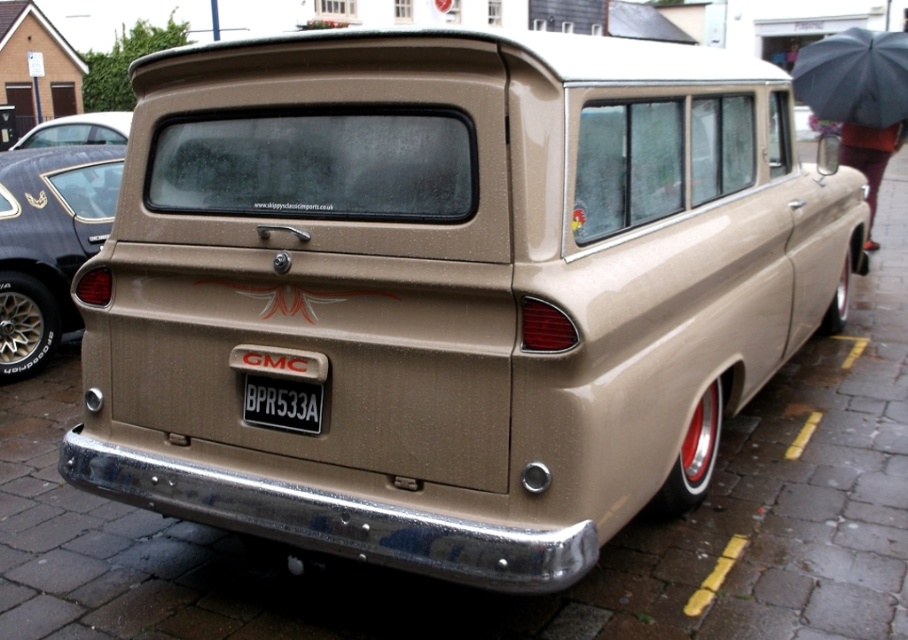
Does matte gold van at center appear over matte black car at upper left?

Incorrect, matte gold van at center is not positioned above matte black car at upper left.

Can you confirm if matte gold van at center is positioned to the right of matte black car at upper left?

Yes, matte gold van at center is to the right of matte black car at upper left.

Is point (25, 264) in front of point (48, 131)?

Yes, it is in front of point (48, 131).

What are the coordinates of `matte gold van at center` in the screenshot? It's located at (48, 243).

Who is positioned more to the right, matte gold van at center or black plastic license plate at center?

black plastic license plate at center is more to the right.

Does matte gold van at center have a greater height compared to black plastic license plate at center?

Indeed, matte gold van at center has a greater height compared to black plastic license plate at center.

Between point (25, 198) and point (307, 428), which one is positioned in front?

Point (307, 428)

Image resolution: width=908 pixels, height=640 pixels. What are the coordinates of `matte gold van at center` in the screenshot? It's located at (48, 243).

Between point (867, 38) and point (290, 381), which one is positioned in front?

Point (290, 381) is more forward.

Does black matte umbrella at upper right appear on the left side of black plastic license plate at center?

Incorrect, black matte umbrella at upper right is not on the left side of black plastic license plate at center.

The width and height of the screenshot is (908, 640). Identify the location of black matte umbrella at upper right. (854, 77).